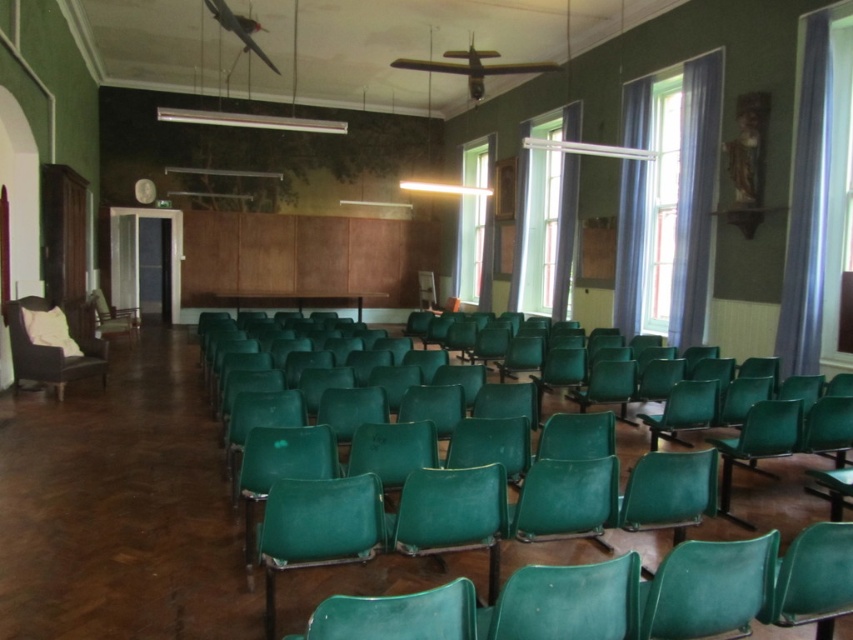
Question: Which point is closer to the camera taking this photo?

Choices:
 (A) (756, 625)
 (B) (88, 301)
 (C) (15, 317)

Answer: (A)

Question: Is velvet brown armchair at left positioned before green plastic chair at left?

Choices:
 (A) yes
 (B) no

Answer: (A)

Question: Is velvet brown armchair at left above green plastic chair at left?

Choices:
 (A) yes
 (B) no

Answer: (B)

Question: Considering the real-world distances, which object is farthest from the matte green armchair at center?

Choices:
 (A) green plastic chair at left
 (B) velvet brown armchair at left

Answer: (A)

Question: Does velvet brown armchair at left lie in front of green plastic chair at left?

Choices:
 (A) yes
 (B) no

Answer: (A)

Question: Which of the following is the closest to the observer?

Choices:
 (A) green plastic chair at left
 (B) matte green armchair at center
 (C) velvet brown armchair at left

Answer: (B)